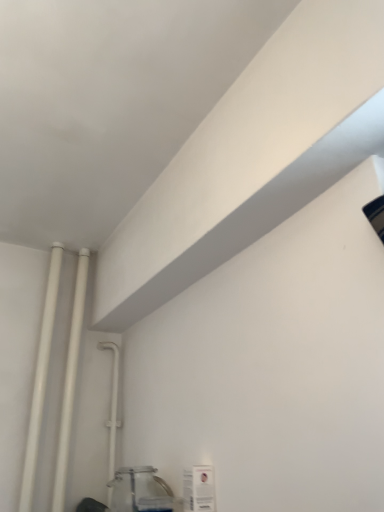
Question: Is white glossy pipes at left, the 2th pipe when ordered from right to left, at the left side of clear glass jar at lower left?

Choices:
 (A) no
 (B) yes

Answer: (B)

Question: Can clear glass jar at lower left be found inside white glossy pipes at left, the 2th pipe when ordered from right to left?

Choices:
 (A) no
 (B) yes

Answer: (A)

Question: Is white glossy pipes at left, the 2th pipe when ordered from right to left, shorter than clear glass jar at lower left?

Choices:
 (A) no
 (B) yes

Answer: (A)

Question: Considering the relative sizes of white glossy pipes at left, the 2th pipe when ordered from right to left, and clear glass jar at lower left in the image provided, is white glossy pipes at left, the 2th pipe when ordered from right to left, bigger than clear glass jar at lower left?

Choices:
 (A) no
 (B) yes

Answer: (A)

Question: Is the position of white glossy pipes at left, positioned as the second pipe in left-to-right order, less distant than that of clear glass jar at lower left?

Choices:
 (A) yes
 (B) no

Answer: (B)

Question: From the image's perspective, is clear glass jar at lower left positioned above or below white plastic pipe at upper left, placed as the 3th pipe when sorted from left to right?

Choices:
 (A) above
 (B) below

Answer: (B)

Question: In terms of height, does clear glass jar at lower left look taller or shorter compared to white plastic pipe at upper left, placed as the 3th pipe when sorted from left to right?

Choices:
 (A) tall
 (B) short

Answer: (B)

Question: Visually, is clear glass jar at lower left positioned to the left or to the right of white plastic pipe at upper left, marked as the first pipe in a right-to-left arrangement?

Choices:
 (A) left
 (B) right

Answer: (B)

Question: Considering their positions, is clear glass jar at lower left located in front of or behind white plastic pipe at upper left, marked as the first pipe in a right-to-left arrangement?

Choices:
 (A) front
 (B) behind

Answer: (A)

Question: Would you say white matte pipe at left, the 3th pipe from the right, is inside or outside white plastic pipe at upper left, marked as the first pipe in a right-to-left arrangement?

Choices:
 (A) outside
 (B) inside

Answer: (A)

Question: Is white matte pipe at left, the 3th pipe from the right, wider or thinner than white plastic pipe at upper left, marked as the first pipe in a right-to-left arrangement?

Choices:
 (A) thin
 (B) wide

Answer: (A)

Question: Considering the positions of white matte pipe at left, the 3th pipe from the right, and white plastic pipe at upper left, placed as the 3th pipe when sorted from left to right, in the image, is white matte pipe at left, the 3th pipe from the right, taller or shorter than white plastic pipe at upper left, placed as the 3th pipe when sorted from left to right,?

Choices:
 (A) short
 (B) tall

Answer: (B)

Question: Is white matte pipe at left, marked as the first pipe in a left-to-right arrangement, to the left or to the right of white plastic pipe at upper left, marked as the first pipe in a right-to-left arrangement, in the image?

Choices:
 (A) left
 (B) right

Answer: (A)

Question: Is clear glass jar at lower left in front of or behind white glossy pipes at left, the 2th pipe when ordered from right to left, in the image?

Choices:
 (A) behind
 (B) front

Answer: (B)

Question: From a real-world perspective, is clear glass jar at lower left above or below white glossy pipes at left, the 2th pipe when ordered from right to left?

Choices:
 (A) below
 (B) above

Answer: (A)